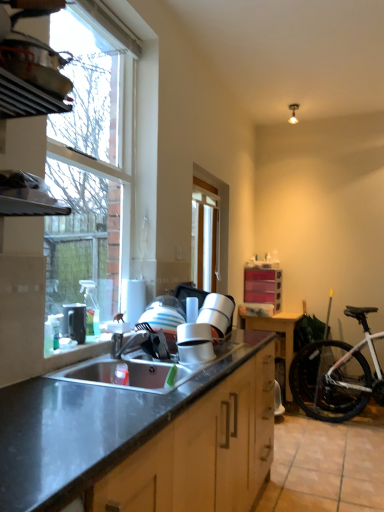
Question: From the image's perspective, is white matte bicycle at lower right located beneath wooden table at right?

Choices:
 (A) yes
 (B) no

Answer: (B)

Question: Considering the relative sizes of white matte bicycle at lower right and wooden table at right in the image provided, is white matte bicycle at lower right smaller than wooden table at right?

Choices:
 (A) yes
 (B) no

Answer: (B)

Question: From the image's perspective, is white matte bicycle at lower right on top of wooden table at right?

Choices:
 (A) yes
 (B) no

Answer: (A)

Question: Is white matte bicycle at lower right turned away from wooden table at right?

Choices:
 (A) yes
 (B) no

Answer: (B)

Question: Does white matte bicycle at lower right appear on the right side of wooden table at right?

Choices:
 (A) yes
 (B) no

Answer: (A)

Question: From the image's perspective, relative to wooden table at right, is clear glass window at upper left, which is the 2th window in right-to-left order, above or below?

Choices:
 (A) above
 (B) below

Answer: (A)

Question: Is clear glass window at upper left, which is the first window from left to right, to the left or to the right of wooden table at right in the image?

Choices:
 (A) left
 (B) right

Answer: (A)

Question: Which is correct: clear glass window at upper left, which is the first window from left to right, is inside wooden table at right, or outside of it?

Choices:
 (A) inside
 (B) outside

Answer: (B)

Question: Looking at their shapes, would you say clear glass window at upper left, which is the 2th window in right-to-left order, is wider or thinner than wooden table at right?

Choices:
 (A) wide
 (B) thin

Answer: (B)

Question: In the image, is stainless steel sink at lower center on the left side or the right side of brushed metal faucet at sink?

Choices:
 (A) right
 (B) left

Answer: (A)

Question: From the image's perspective, is stainless steel sink at lower center located above or below brushed metal faucet at sink?

Choices:
 (A) above
 (B) below

Answer: (B)

Question: Considering the positions of point (114, 382) and point (145, 337), is point (114, 382) closer or farther from the camera than point (145, 337)?

Choices:
 (A) closer
 (B) farther

Answer: (A)

Question: In the image, is stainless steel sink at lower center positioned in front of or behind brushed metal faucet at sink?

Choices:
 (A) front
 (B) behind

Answer: (A)

Question: Do you think clear glass window at center, which is the 1th window from right to left, is within matte black kettle at left, or outside of it?

Choices:
 (A) inside
 (B) outside

Answer: (B)

Question: Considering the positions of clear glass window at center, marked as the first window in a back-to-front arrangement, and matte black kettle at left in the image, is clear glass window at center, marked as the first window in a back-to-front arrangement, bigger or smaller than matte black kettle at left?

Choices:
 (A) small
 (B) big

Answer: (B)